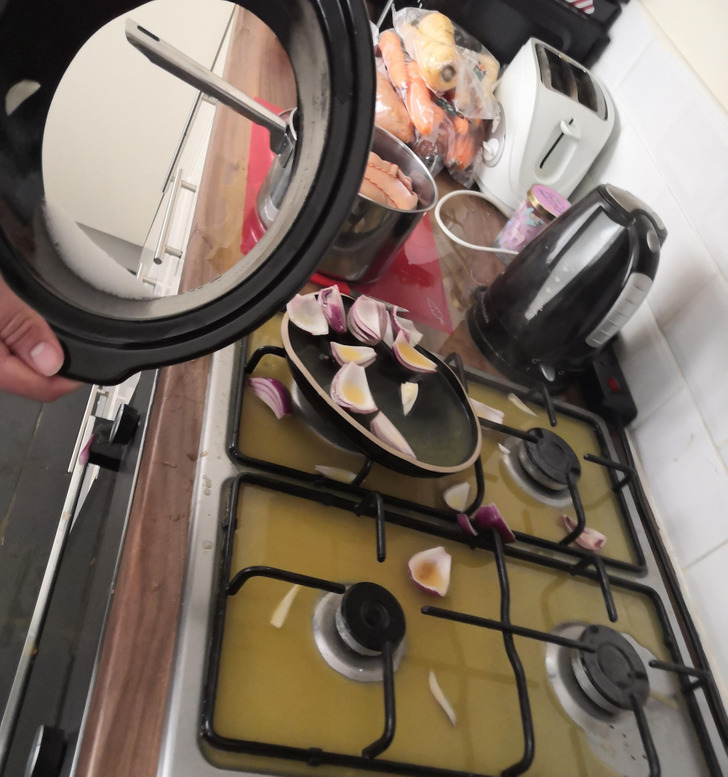
Locate an element on the screen. The image size is (728, 777). white toaster is located at coordinates (536, 117).